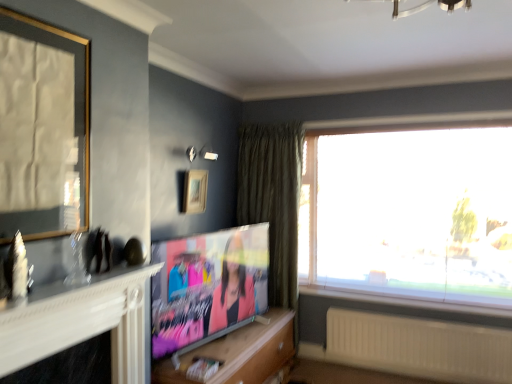
What is the approximate width of wooden picture frame at upper center, which is the 2th picture frame in left-to-right order?

4.20 inches.

What is the approximate height of wooden picture frame at upper center, marked as the first picture frame in a back-to-front arrangement?

wooden picture frame at upper center, marked as the first picture frame in a back-to-front arrangement, is 14.03 inches in height.

Image resolution: width=512 pixels, height=384 pixels. What do you see at coordinates (42, 128) in the screenshot?
I see `gold-framed mirror at upper left, which is counted as the second picture frame, starting from the right` at bounding box center [42, 128].

You are a GUI agent. You are given a task and a screenshot of the screen. Output one action in this format:
    pyautogui.click(x=<x>, y=<y>)
    Task: Click on the gold-framed mirror at upper left, which is counted as the second picture frame, starting from the right
    
    Given the screenshot: What is the action you would take?
    pyautogui.click(x=42, y=128)

Describe the element at coordinates (203, 368) in the screenshot. I see `matte paper magazine at lower center` at that location.

At what (x,y) coordinates should I click in order to perform the action: click on wooden cabinet at center. Please return your answer as a coordinate pair (x, y). This screenshot has height=384, width=512. Looking at the image, I should click on (240, 353).

I want to click on white glossy fireplace at left, so click(x=81, y=322).

Are gold-framed mirror at upper left, which is counted as the second picture frame, starting from the right, and matte paper magazine at lower center making contact?

There is a gap between gold-framed mirror at upper left, which is counted as the second picture frame, starting from the right, and matte paper magazine at lower center.

Which is nearer, (50, 178) or (222, 364)?

Point (50, 178).

Does gold-framed mirror at upper left, which is the 2th picture frame in back-to-front order, turn towards matte paper magazine at lower center?

No, gold-framed mirror at upper left, which is the 2th picture frame in back-to-front order, is not aimed at matte paper magazine at lower center.

Considering the positions of objects white glossy fireplace at left and transparent glass window at right in the image provided, who is behind, white glossy fireplace at left or transparent glass window at right?

transparent glass window at right is more distant.

Is white glossy fireplace at left shorter than transparent glass window at right?

Correct, white glossy fireplace at left is not as tall as transparent glass window at right.

The height and width of the screenshot is (384, 512). I want to click on fireplace that appears below the transparent glass window at right (from the image's perspective), so click(x=81, y=322).

What's the angular difference between white glossy fireplace at left and transparent glass window at right's facing directions?

The angle between the facing direction of white glossy fireplace at left and the facing direction of transparent glass window at right is 89.9 degrees.

Does matte black tv at center have a lesser height compared to white glossy fireplace at left?

No.

Is matte black tv at center to the left or to the right of white glossy fireplace at left in the image?

Based on their positions, matte black tv at center is located to the right of white glossy fireplace at left.

Which object is further away from the camera taking this photo, white ribbed radiator at lower right or wooden picture frame at upper center, which is the 2th picture frame in left-to-right order?

wooden picture frame at upper center, which is the 2th picture frame in left-to-right order, is more distant.

Can you confirm if white ribbed radiator at lower right is smaller than wooden picture frame at upper center, marked as the first picture frame in a back-to-front arrangement?

Actually, white ribbed radiator at lower right might be larger than wooden picture frame at upper center, marked as the first picture frame in a back-to-front arrangement.

Could you measure the distance between white ribbed radiator at lower right and wooden picture frame at upper center, marked as the first picture frame in a back-to-front arrangement?

white ribbed radiator at lower right and wooden picture frame at upper center, marked as the first picture frame in a back-to-front arrangement, are 1.94 meters apart from each other.

The height and width of the screenshot is (384, 512). Find the location of `picture frame on the left of the white glossy fireplace at left`. picture frame on the left of the white glossy fireplace at left is located at coordinates (42, 128).

Is gold-framed mirror at upper left, which is counted as the 1th picture frame, starting from the front, taller or shorter than white glossy fireplace at left?

Clearly, gold-framed mirror at upper left, which is counted as the 1th picture frame, starting from the front, is taller compared to white glossy fireplace at left.

Is gold-framed mirror at upper left, which is the 2th picture frame in back-to-front order, facing towards white glossy fireplace at left?

No, gold-framed mirror at upper left, which is the 2th picture frame in back-to-front order, is not facing towards white glossy fireplace at left.

Does green velvet curtain at center contain matte paper magazine at lower center?

No, matte paper magazine at lower center is not a part of green velvet curtain at center.

Which object is positioned more to the right, green velvet curtain at center or matte paper magazine at lower center?

green velvet curtain at center is more to the right.

How much distance is there between green velvet curtain at center and matte paper magazine at lower center?

5.26 feet.

Considering the positions of point (292, 194) and point (216, 370), is point (292, 194) closer or farther from the camera than point (216, 370)?

Point (292, 194) is farther from the camera than point (216, 370).

Who is taller, matte paper magazine at lower center or white glossy fireplace at left?

white glossy fireplace at left.

Is matte paper magazine at lower center facing away from white glossy fireplace at left?

matte paper magazine at lower center is not turned away from white glossy fireplace at left.

Can you see matte paper magazine at lower center touching white glossy fireplace at left?

No, matte paper magazine at lower center is not beside white glossy fireplace at left.

From the image's perspective, which object appears higher, matte paper magazine at lower center or white glossy fireplace at left?

white glossy fireplace at left.

Where is `magazine on the right side of gold-framed mirror at upper left, which appears as the 1th picture frame when viewed from the left`? This screenshot has width=512, height=384. magazine on the right side of gold-framed mirror at upper left, which appears as the 1th picture frame when viewed from the left is located at coordinates (203, 368).

In order to click on fireplace lying in front of the transparent glass window at right in this screenshot , I will do `click(81, 322)`.

Based on their spatial positions, is transparent glass window at right or green velvet curtain at center further from matte paper magazine at lower center?

Based on the image, transparent glass window at right appears to be further to matte paper magazine at lower center.

From the picture: Looking at the image, which one is located closer to transparent glass window at right, gold-framed mirror at upper left, which is counted as the second picture frame, starting from the right, or wooden cabinet at center?

wooden cabinet at center lies closer to transparent glass window at right than the other object.

Estimate the real-world distances between objects in this image. Which object is further from matte paper magazine at lower center, wooden picture frame at upper center, marked as the first picture frame in a back-to-front arrangement, or green velvet curtain at center?

The object further to matte paper magazine at lower center is green velvet curtain at center.

When comparing their distances from wooden picture frame at upper center, marked as the first picture frame in a back-to-front arrangement, does transparent glass window at right or wooden cabinet at center seem closer?

Among the two, wooden cabinet at center is located nearer to wooden picture frame at upper center, marked as the first picture frame in a back-to-front arrangement.

Looking at the image, which one is located closer to matte black tv at center, wooden picture frame at upper center, which is the 2th picture frame in left-to-right order, or wooden cabinet at center?

wooden cabinet at center lies closer to matte black tv at center than the other object.

When comparing their distances from matte black tv at center, does matte paper magazine at lower center or wooden cabinet at center seem further?

matte paper magazine at lower center is positioned further to the anchor matte black tv at center.

Based on their spatial positions, is transparent glass window at right or matte black tv at center closer to matte paper magazine at lower center?

matte black tv at center lies closer to matte paper magazine at lower center than the other object.

From the picture: From the image, which object appears to be farther from green velvet curtain at center, transparent glass window at right or white ribbed radiator at lower right?

white ribbed radiator at lower right lies further to green velvet curtain at center than the other object.

This screenshot has width=512, height=384. Identify the location of picture frame between matte black tv at center and green velvet curtain at center in the front-back direction. (195, 191).

At what (x,y) coordinates should I click in order to perform the action: click on fireplace between gold-framed mirror at upper left, which is counted as the second picture frame, starting from the right, and transparent glass window at right from left to right. Please return your answer as a coordinate pair (x, y). Looking at the image, I should click on (81, 322).

Image resolution: width=512 pixels, height=384 pixels. Identify the location of cabinetry located between wooden picture frame at upper center, which appears as the 1th picture frame when viewed from the right, and transparent glass window at right in the left-right direction. (240, 353).

Locate an element on the screen. This screenshot has width=512, height=384. picture frame between white glossy fireplace at left and white ribbed radiator at lower right in the horizontal direction is located at coordinates (195, 191).